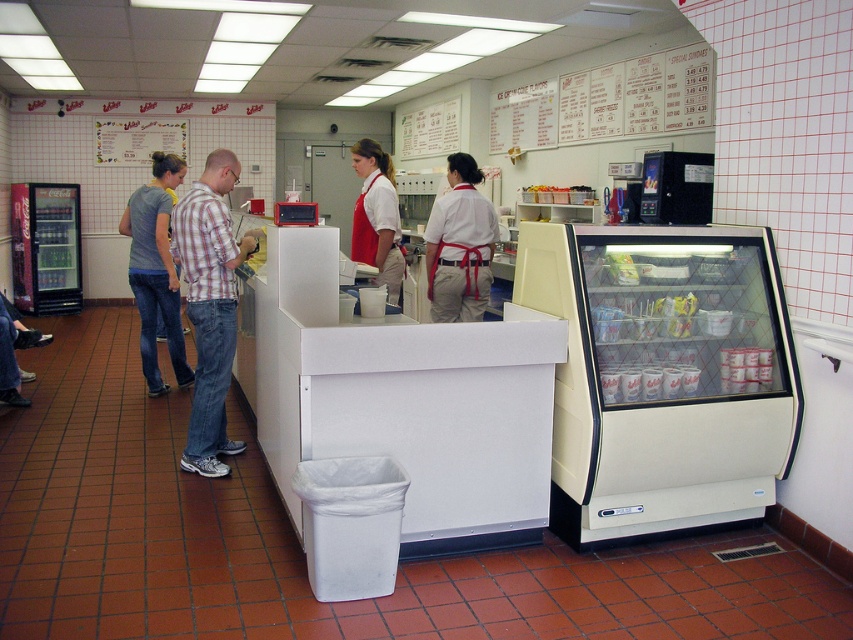
Who is more forward, (165, 292) or (358, 147)?

Positioned in front is point (358, 147).

Between gray cotton shirt at left and white matte shirt at center, which one is positioned higher?

white matte shirt at center is higher up.

Which is behind, point (160, 262) or point (363, 144)?

The point (160, 262) is more distant.

Locate an element on the screen. gray cotton shirt at left is located at coordinates (155, 272).

Is white cotton apron at center shorter than white matte shirt at center?

→ No, white cotton apron at center is not shorter than white matte shirt at center.

The image size is (853, 640). I want to click on white cotton apron at center, so click(459, 244).

Which is in front, point (467, 243) or point (368, 145)?

Point (467, 243) is more forward.

Where is `white cotton apron at center`? The width and height of the screenshot is (853, 640). white cotton apron at center is located at coordinates (459, 244).

Does plaid shirt at center appear under white cotton apron at center?

Yes.

Is plaid shirt at center in front of white cotton apron at center?

Yes, plaid shirt at center is in front of white cotton apron at center.

Describe the element at coordinates (209, 307) in the screenshot. This screenshot has height=640, width=853. I see `plaid shirt at center` at that location.

At what (x,y) coordinates should I click in order to perform the action: click on plaid shirt at center. Please return your answer as a coordinate pair (x, y). This screenshot has width=853, height=640. Looking at the image, I should click on (209, 307).